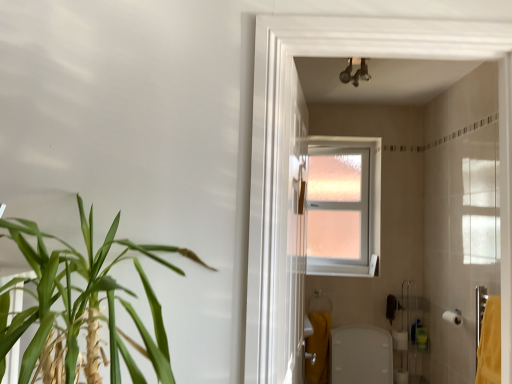
Question: Is clear glass window at upper center wider or thinner than white matte toilet paper at lower right, placed as the second toilet paper when sorted from back to front?

Choices:
 (A) wide
 (B) thin

Answer: (A)

Question: Is clear glass window at upper center in front of or behind white matte toilet paper at lower right, placed as the second toilet paper when sorted from bottom to top, in the image?

Choices:
 (A) front
 (B) behind

Answer: (B)

Question: Which object is the closest to the yellow fabric towel at right, the 1th bath towel from the front?

Choices:
 (A) clear glass window at upper center
 (B) green leafy plant at left
 (C) clear glass screen door at center
 (D) yellow fabric bath towel at lower right, which is counted as the first bath towel, starting from the left
 (E) white matte toilet paper at lower right, arranged as the second toilet paper when viewed from the right

Answer: (C)

Question: Which object is positioned farthest from the yellow fabric bath towel at lower right, positioned as the 2th bath towel in right-to-left order?

Choices:
 (A) green leafy plant at left
 (B) clear glass screen door at center
 (C) white matte toilet paper at lower right, placed as the second toilet paper when sorted from bottom to top
 (D) metallic chrome light fixture at upper center
 (E) yellow fabric towel at right, the second bath towel in the left-to-right sequence

Answer: (A)